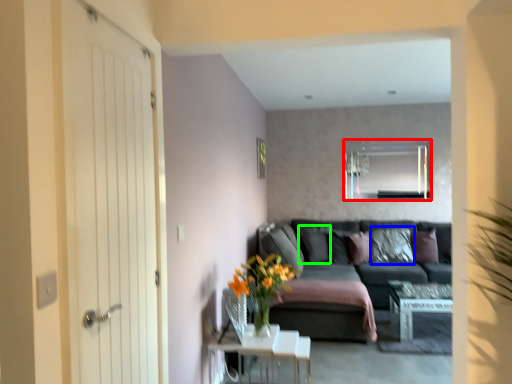
Question: Considering the real-world distances, which object is farthest from mirror (highlighted by a red box)? pillow (highlighted by a blue box) or pillow (highlighted by a green box)?

Choices:
 (A) pillow
 (B) pillow

Answer: (B)